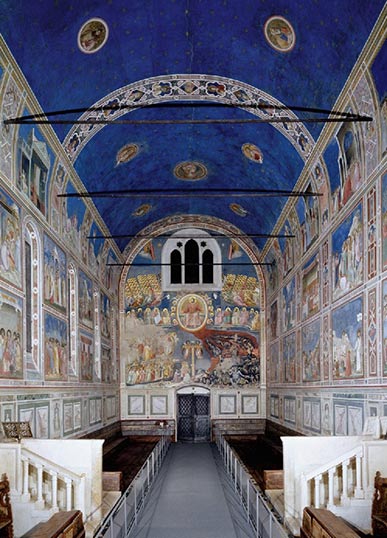
The height and width of the screenshot is (538, 387). Identify the location of left door. (184, 413).